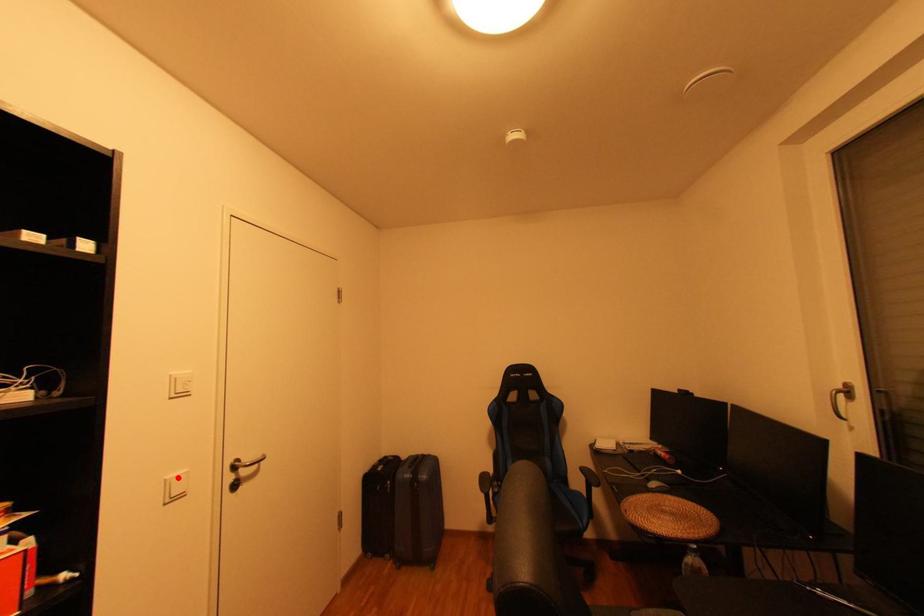
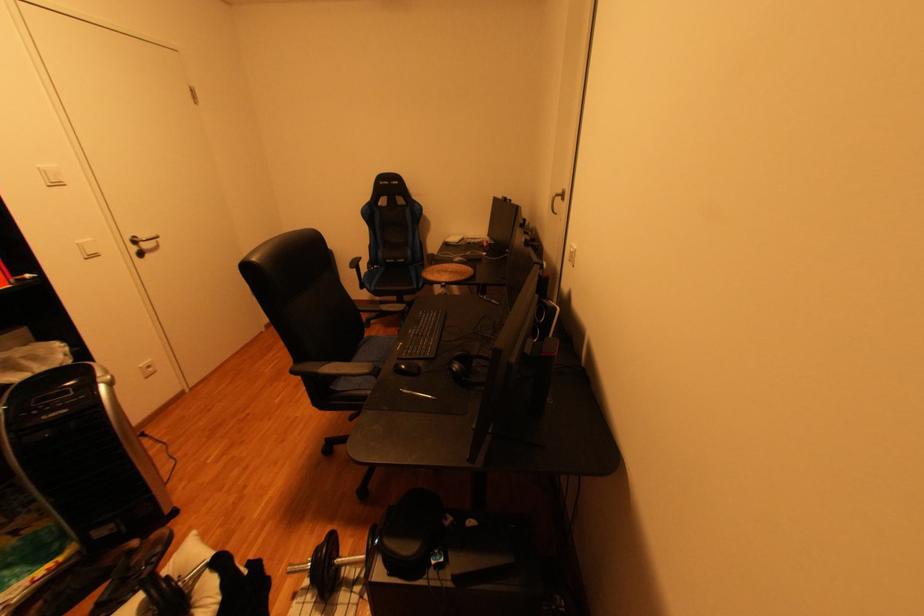
Question: I am providing you with two images of the same scene from different viewpoints. A red point is shown in image1. For the corresponding object point in image2, is it positioned nearer or farther from the camera?

Choices:
 (A) Nearer
 (B) Farther

Answer: (B)